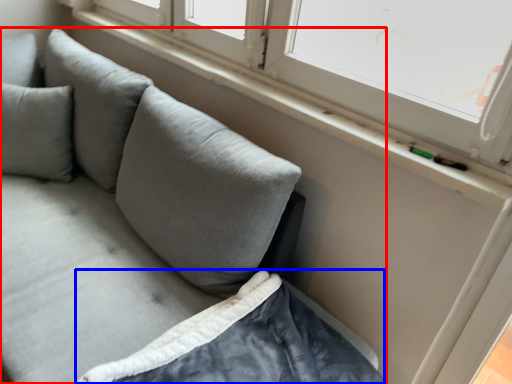
Question: Which point is closer to the camera, studio couch (highlighted by a red box) or sheet (highlighted by a blue box)?

Choices:
 (A) studio couch
 (B) sheet

Answer: (A)